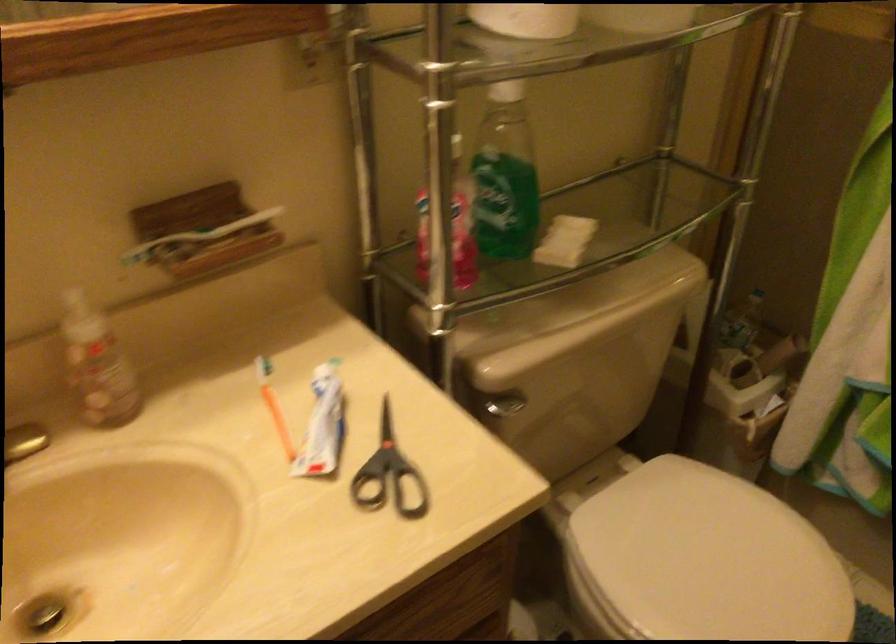
Identify the location of white toilet lid. (x=702, y=560).